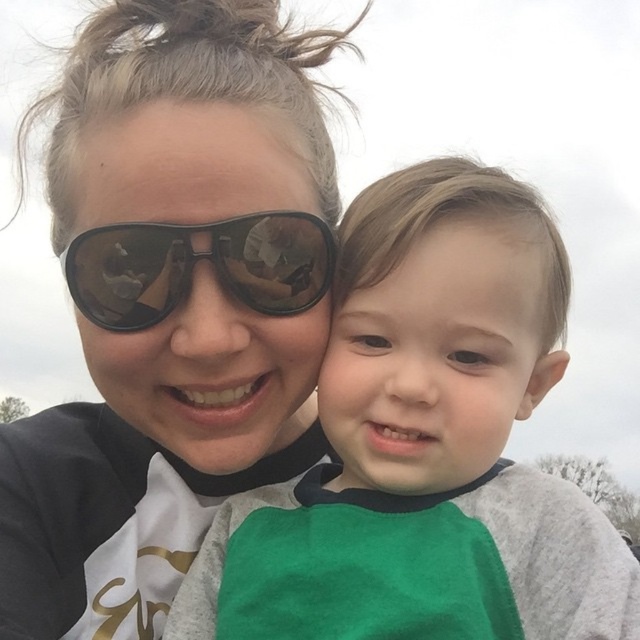
Question: Which point is closer to the camera taking this photo?

Choices:
 (A) (467, 323)
 (B) (499, 266)
 (C) (170, 310)
 (D) (288, 67)

Answer: (A)

Question: Which object is the farthest from the green fabric face at center?

Choices:
 (A) matte black sunglasses at upper left
 (B) green fabric shirt at center
 (C) matte black goggles at center
 (D) matte black sunglasses at upper center

Answer: (A)

Question: Observing the image, what is the correct spatial positioning of matte black sunglasses at upper left in reference to matte black goggles at center?

Choices:
 (A) left
 (B) right

Answer: (A)

Question: Estimate the real-world distances between objects in this image. Which object is farther from the matte black sunglasses at upper left?

Choices:
 (A) green fabric shirt at center
 (B) matte black sunglasses at upper center
 (C) matte black goggles at center
 (D) green fabric face at center

Answer: (A)

Question: From the image, what is the correct spatial relationship of green fabric shirt at center in relation to matte black sunglasses at upper center?

Choices:
 (A) above
 (B) below

Answer: (B)

Question: Is matte black sunglasses at upper center thinner than green fabric face at center?

Choices:
 (A) no
 (B) yes

Answer: (A)